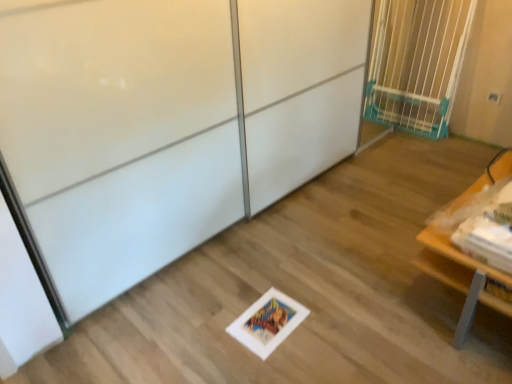
Question: Considering the relative sizes of blue plastic gate at upper right and wooden table at lower right in the image provided, is blue plastic gate at upper right shorter than wooden table at lower right?

Choices:
 (A) yes
 (B) no

Answer: (B)

Question: Can you see blue plastic gate at upper right touching wooden table at lower right?

Choices:
 (A) yes
 (B) no

Answer: (B)

Question: Would you say blue plastic gate at upper right contains wooden table at lower right?

Choices:
 (A) no
 (B) yes

Answer: (A)

Question: Considering the relative positions of blue plastic gate at upper right and wooden table at lower right in the image provided, is blue plastic gate at upper right to the left of wooden table at lower right from the viewer's perspective?

Choices:
 (A) yes
 (B) no

Answer: (B)

Question: Would you consider blue plastic gate at upper right to be distant from wooden table at lower right?

Choices:
 (A) yes
 (B) no

Answer: (A)

Question: Does blue plastic gate at upper right turn towards wooden table at lower right?

Choices:
 (A) yes
 (B) no

Answer: (B)

Question: Can you confirm if blue plastic gate at upper right is wider than white glossy screen door at center?

Choices:
 (A) yes
 (B) no

Answer: (B)

Question: Considering the relative sizes of blue plastic gate at upper right and white glossy screen door at center in the image provided, is blue plastic gate at upper right thinner than white glossy screen door at center?

Choices:
 (A) no
 (B) yes

Answer: (B)

Question: Is blue plastic gate at upper right looking in the opposite direction of white glossy screen door at center?

Choices:
 (A) yes
 (B) no

Answer: (A)

Question: Can you confirm if blue plastic gate at upper right is shorter than white glossy screen door at center?

Choices:
 (A) yes
 (B) no

Answer: (A)

Question: Is blue plastic gate at upper right not near white glossy screen door at center?

Choices:
 (A) no
 (B) yes

Answer: (B)

Question: Can you confirm if blue plastic gate at upper right is positioned to the left of white glossy screen door at center?

Choices:
 (A) no
 (B) yes

Answer: (A)

Question: From a real-world perspective, is white glossy screen door at center located higher than wooden table at lower right?

Choices:
 (A) yes
 (B) no

Answer: (A)